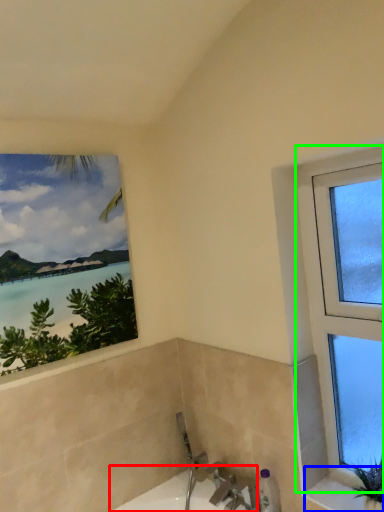
Question: Which is nearer to the bath (highlighted by a red box)? window sill (highlighted by a blue box) or window (highlighted by a green box).

Choices:
 (A) window sill
 (B) window

Answer: (A)